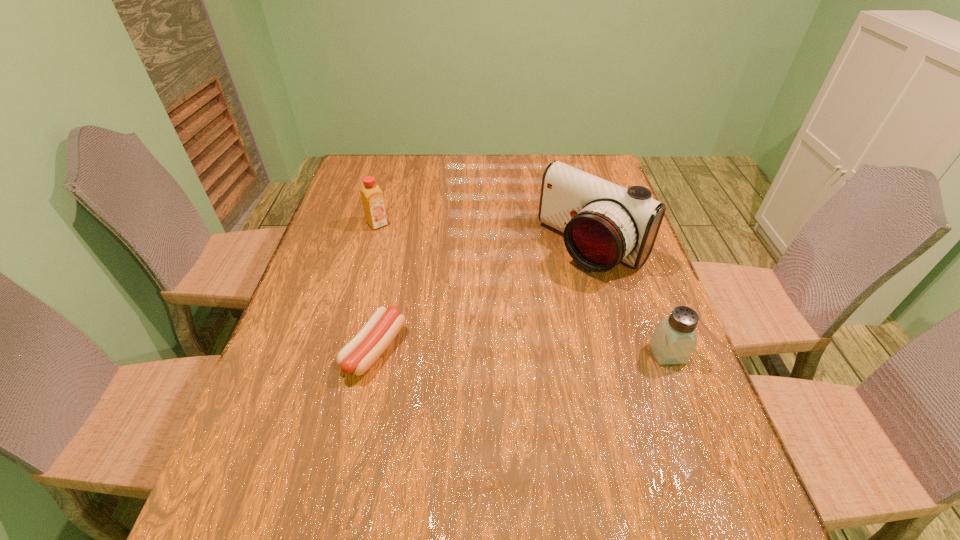
Identify the location of vacant space on the desktop that is between the sausage and the saltshaker and is positioned on the front and back of the orange juice. (502, 351).

In order to click on free space on the desktop that is between the shortest object and the third tallest object and is positioned on the surface of the tallest object in this screenshot , I will do `click(481, 350)`.